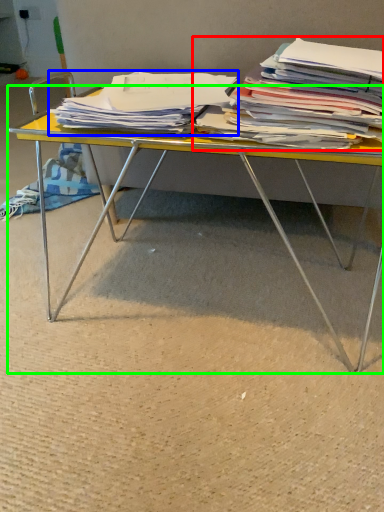
Question: Which object is the farthest from magazine (highlighted by a red box)? Choose among these: magazine (highlighted by a blue box) or desk (highlighted by a green box).

Choices:
 (A) magazine
 (B) desk

Answer: (B)